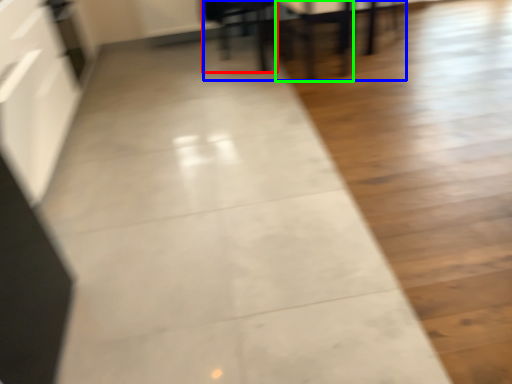
Question: Which object is positioned farthest from furniture (highlighted by a red box)? Select from table (highlighted by a blue box) and armchair (highlighted by a green box).

Choices:
 (A) table
 (B) armchair

Answer: (B)